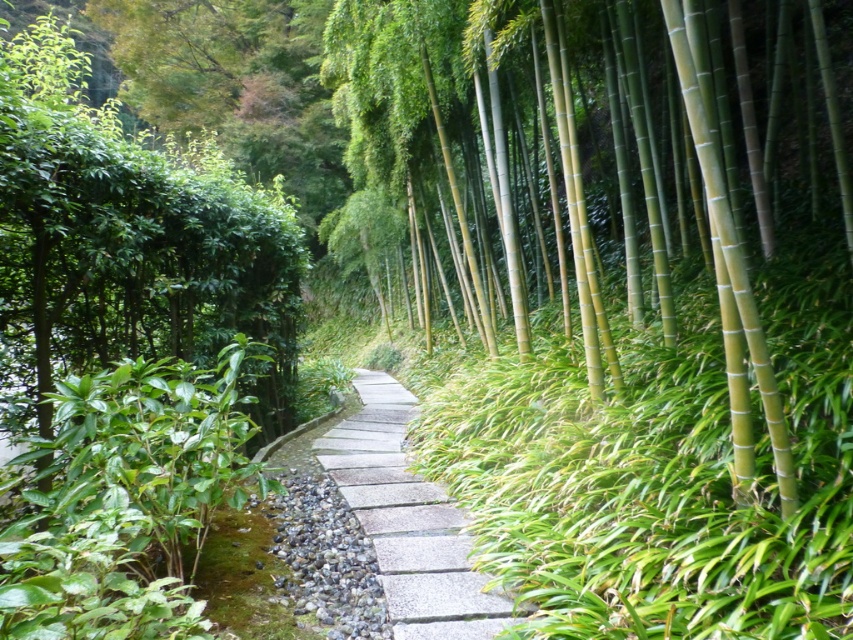
Question: Is green smooth bamboo at right to the right of gray stone path at center from the viewer's perspective?

Choices:
 (A) yes
 (B) no

Answer: (A)

Question: Which object appears closest to the camera in this image?

Choices:
 (A) gray stone path at center
 (B) green smooth bamboo at right

Answer: (B)

Question: Does green smooth bamboo at right appear on the right side of gray stone path at center?

Choices:
 (A) yes
 (B) no

Answer: (A)

Question: In this image, where is green smooth bamboo at right located relative to gray stone path at center?

Choices:
 (A) left
 (B) right

Answer: (B)